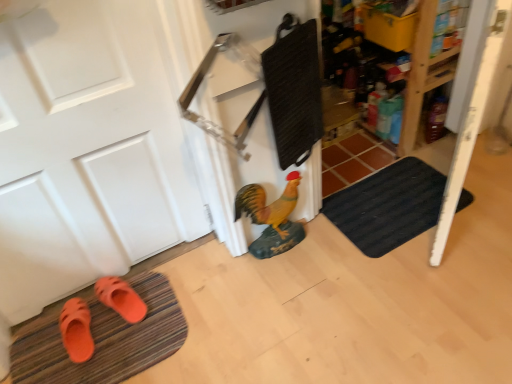
You are a GUI agent. You are given a task and a screenshot of the screen. Output one action in this format:
    pyautogui.click(x=<x>, y=<y>)
    Task: Click on the vacant region under shiny yellow chicken at center (from a real-world perspective)
    Image resolution: width=512 pixels, height=384 pixels.
    Given the screenshot: What is the action you would take?
    pyautogui.click(x=276, y=251)